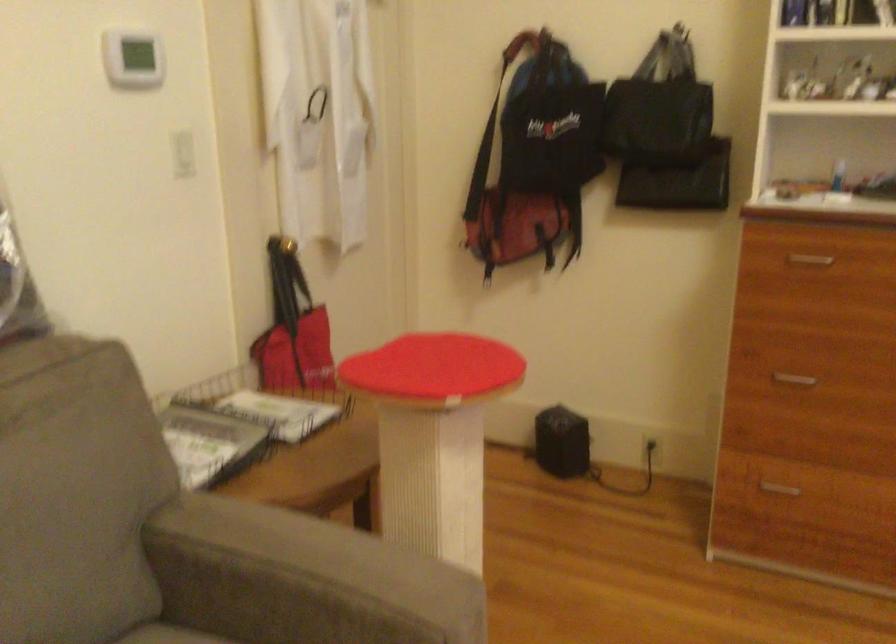
The image size is (896, 644). Describe the element at coordinates (434, 366) in the screenshot. I see `the red stool top` at that location.